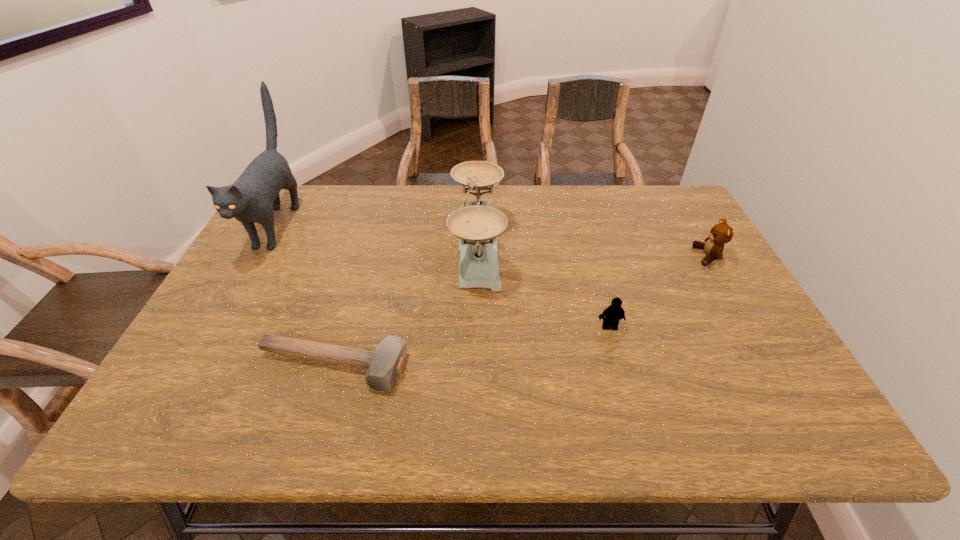
Where is `the leftmost object`? the leftmost object is located at coordinates (252, 198).

Locate an element on the screen. The image size is (960, 540). the tallest object is located at coordinates (252, 198).

Where is `the fourth shortest object`? The height and width of the screenshot is (540, 960). the fourth shortest object is located at coordinates (477, 225).

This screenshot has height=540, width=960. I want to click on the third object from left to right, so click(477, 225).

The height and width of the screenshot is (540, 960). I want to click on the rightmost object, so click(721, 233).

This screenshot has height=540, width=960. What are the coordinates of `teddy bear` in the screenshot? It's located at (721, 233).

Locate an element on the screen. This screenshot has height=540, width=960. the second object from right to left is located at coordinates (613, 313).

Identify the location of the second shortest object. The height and width of the screenshot is (540, 960). (613, 313).

The width and height of the screenshot is (960, 540). I want to click on the fourth object from right to left, so click(x=384, y=365).

The height and width of the screenshot is (540, 960). I want to click on the nearest object, so click(x=384, y=365).